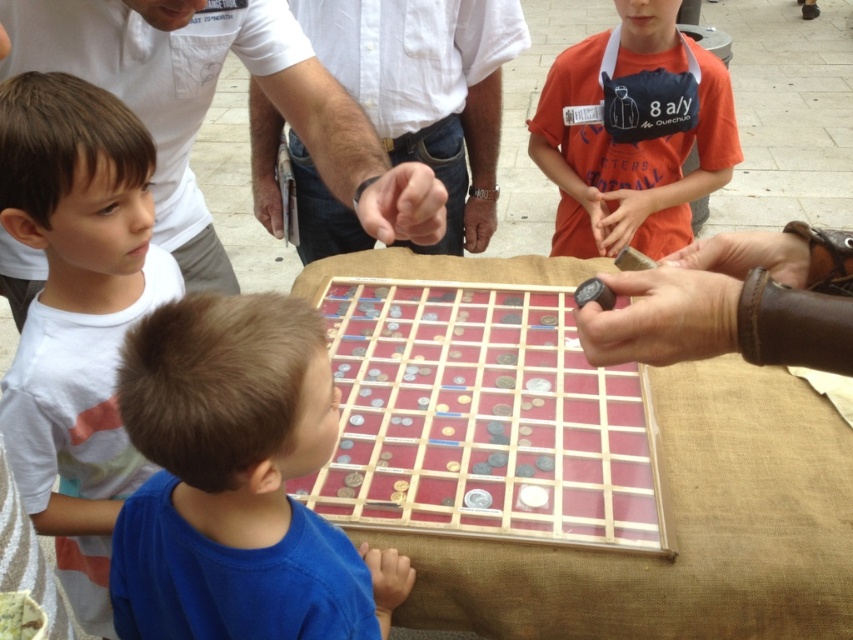
You are a participant in the game and notice the wooden grid at center and the white shirt at center. Which object takes up less space in the scene?

The wooden grid at center has a smaller size compared to the white shirt at center, so it takes up less space.

Looking at this image, you are standing in front of the table where the game is happening. You notice two people wearing cotton shirts. The first is wearing a white cotton shirt at left and the second an orange cotton shirt at upper right. Which shirt is positioned lower in the image?

The white cotton shirt at left is located below the orange cotton shirt at upper right, so the white cotton shirt at left is positioned lower in the image.